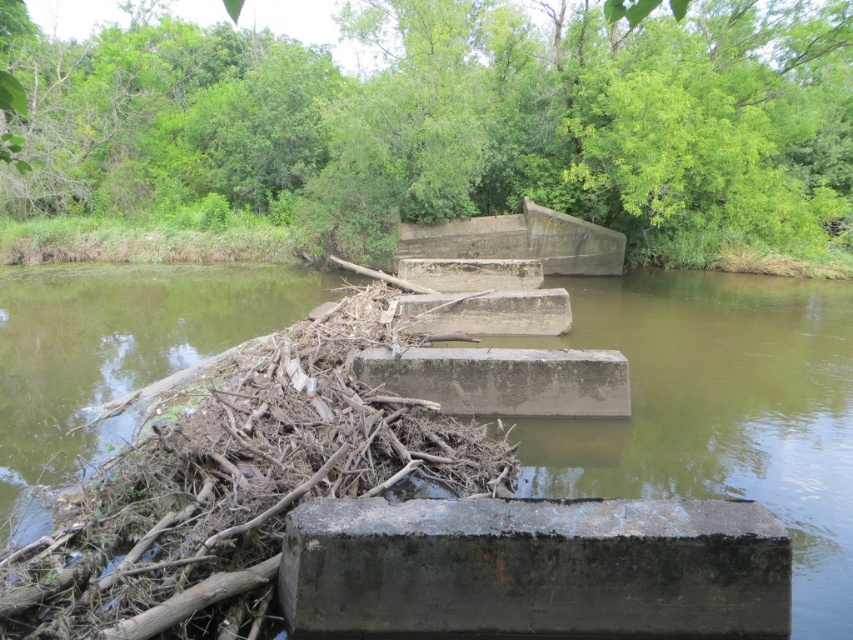
You are a wildlife researcher observing the waterway scene. You notice the concrete blocks at center and the dark gray concrete block at center. Which one is located above the other?

The concrete blocks at center is positioned over the dark gray concrete block at center, so the concrete blocks at center is above the dark gray concrete block at center.

You are standing at the edge of the waterway and want to determine which of the two points, point (308, 589) or point (517, 369), is closer to you. Based on the scene, which point is nearer?

Point (308, 589) is closer to the viewer than point (517, 369).

From the picture: You are standing at the edge of the waterway and want to place a 4 meter long wooden board from your position to the concrete blocks at center. Is the board long enough to reach?

The distance of concrete blocks at center from viewer is 3.95 meters, so yes, the 4 meter long wooden board is long enough to reach the concrete blocks at center.